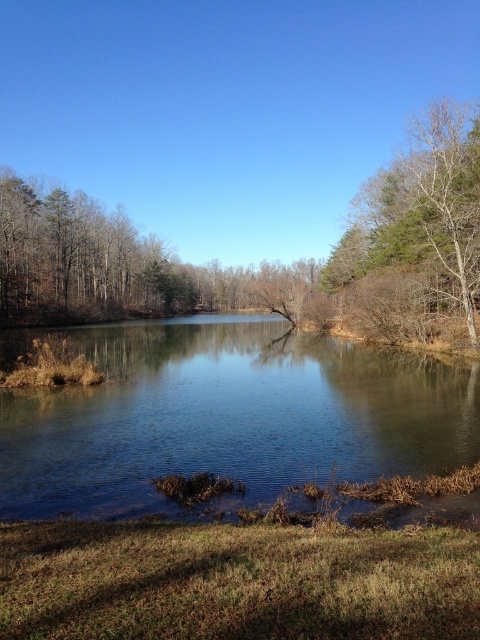
Question: Is clear water at center closer to camera compared to bare branches at right?

Choices:
 (A) yes
 (B) no

Answer: (A)

Question: Can you confirm if clear water at center is positioned below bare branches at right?

Choices:
 (A) yes
 (B) no

Answer: (A)

Question: Among these objects, which one is nearest to the camera?

Choices:
 (A) bare branches at right
 (B) clear water at center

Answer: (B)

Question: Can you confirm if clear water at center is thinner than bare branches at right?

Choices:
 (A) yes
 (B) no

Answer: (B)